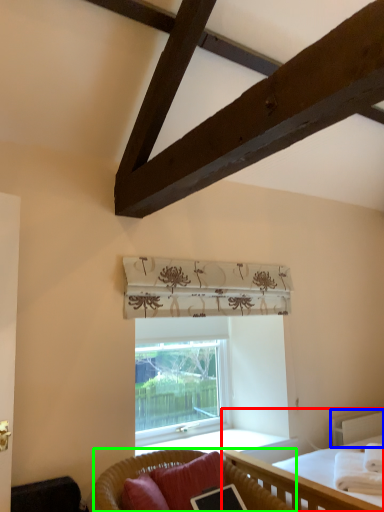
Question: Which object is the farthest from bed (highlighted by a red box)? Choose among these: balustrade (highlighted by a blue box) or studio couch (highlighted by a green box).

Choices:
 (A) balustrade
 (B) studio couch

Answer: (A)